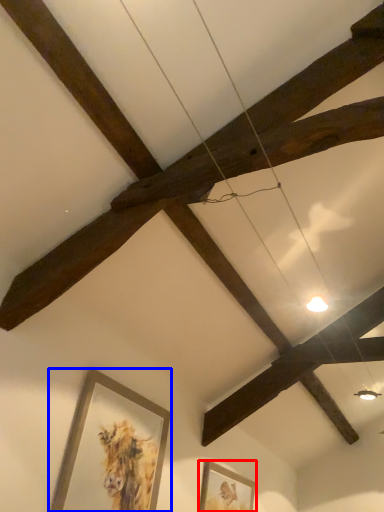
Question: Which object is further to the camera taking this photo, picture frame (highlighted by a red box) or picture frame (highlighted by a blue box)?

Choices:
 (A) picture frame
 (B) picture frame

Answer: (A)